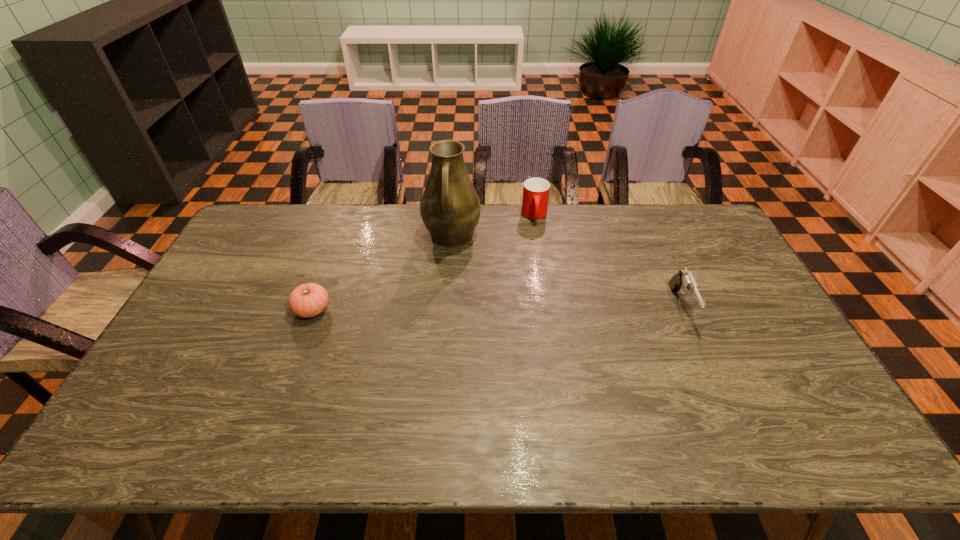
Find the location of a particular element. The width and height of the screenshot is (960, 540). free location located 0.340m on the handle side of the pitcher is located at coordinates click(x=440, y=340).

Locate an element on the screen. This screenshot has height=540, width=960. free region located on the side of the cup with the handle is located at coordinates (536, 235).

This screenshot has height=540, width=960. I want to click on vacant area situated 0.140m on the side of the cup with the handle, so click(537, 252).

Locate an element on the screen. This screenshot has width=960, height=540. vacant region located 0.160m on the side of the cup with the handle is located at coordinates (537, 255).

At what (x,y) coordinates should I click in order to perform the action: click on pitcher positioned at the far edge. Please return your answer as a coordinate pair (x, y). Looking at the image, I should click on (450, 207).

Locate an element on the screen. cup that is at the far edge is located at coordinates (536, 191).

The height and width of the screenshot is (540, 960). I want to click on free space at the far edge of the desktop, so click(x=662, y=240).

In order to click on vacant space at the near edge of the desktop in this screenshot , I will do `click(587, 405)`.

Identify the location of free space at the left edge of the desktop. The height and width of the screenshot is (540, 960). (251, 259).

Find the location of a particular element. vacant space at the right edge of the desktop is located at coordinates (703, 255).